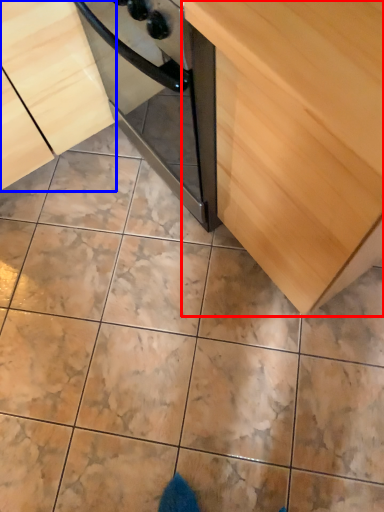
Question: Which of the following is the closest to the observer, cabinetry (highlighted by a red box) or cabinetry (highlighted by a blue box)?

Choices:
 (A) cabinetry
 (B) cabinetry

Answer: (A)